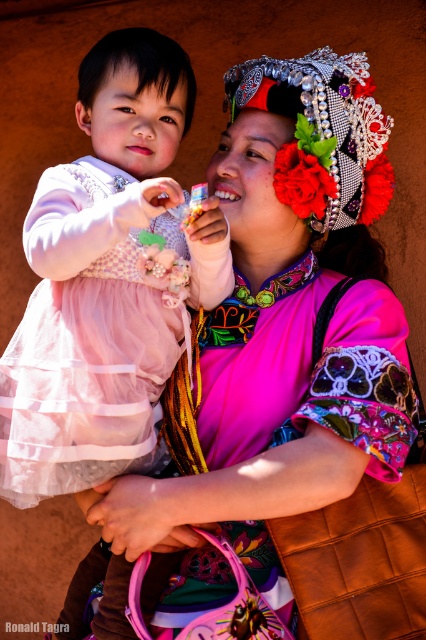
Is matte pink dress at left thinner than silver metallic headdress at upper center?

In fact, matte pink dress at left might be wider than silver metallic headdress at upper center.

The width and height of the screenshot is (426, 640). I want to click on matte pink dress at left, so click(x=106, y=278).

Identify the location of matte pink dress at left. The width and height of the screenshot is (426, 640). (106, 278).